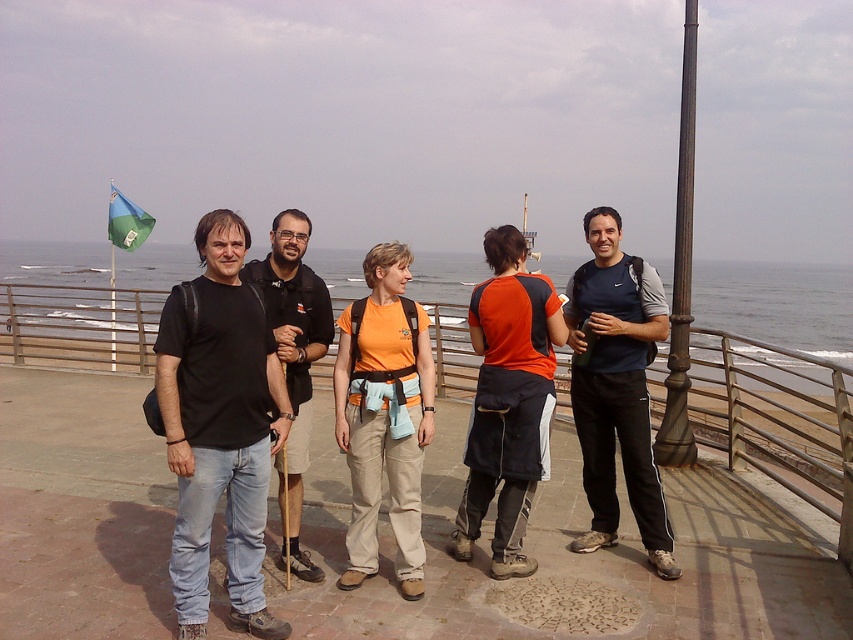
Can you confirm if metal at left is positioned below orange fabric backpack at center?

Yes.

Does point (834, 508) lie in front of point (506, 323)?

No, it is not.

Measure the distance between point (734, 372) and camera.

5.95 meters

Where is `metal at left`? This screenshot has width=853, height=640. metal at left is located at coordinates (775, 419).

Is point (370, 269) closer to viewer compared to point (291, 323)?

Yes, point (370, 269) is in front of point (291, 323).

Does orange fabric shirt at center have a lesser width compared to black matte shirt at center?

No, orange fabric shirt at center is not thinner than black matte shirt at center.

What do you see at coordinates (384, 416) in the screenshot?
I see `orange fabric shirt at center` at bounding box center [384, 416].

Locate an element on the screen. This screenshot has width=853, height=640. orange fabric shirt at center is located at coordinates (384, 416).

Is orange fabric backpack at center further to camera compared to bronze/golden metal pole at right?

No, it is not.

Between orange fabric backpack at center and bronze/golden metal pole at right, which one is positioned higher?

bronze/golden metal pole at right is higher up.

Does point (506, 244) lie behind point (683, 444)?

No, (506, 244) is in front of (683, 444).

Locate an element on the screen. orange fabric backpack at center is located at coordinates (508, 401).